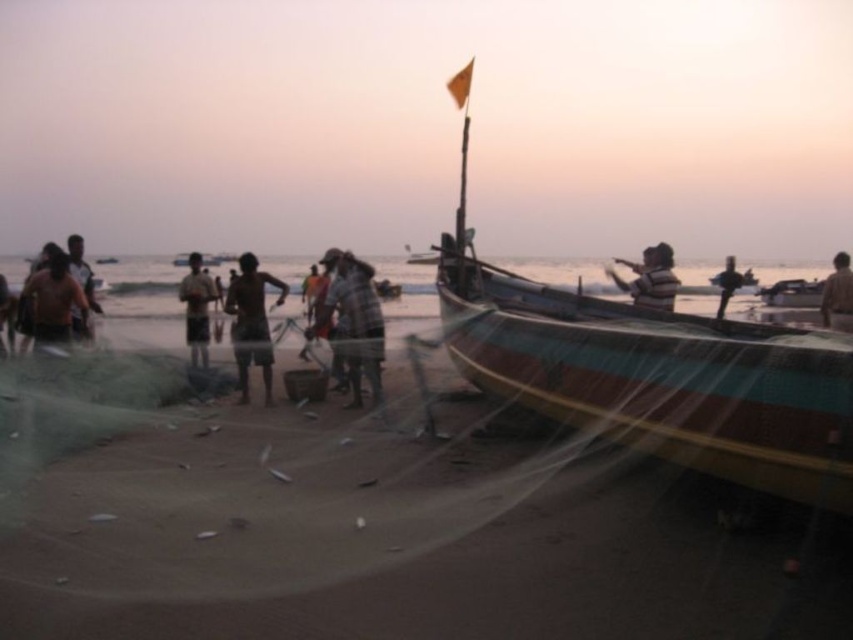
Is checkered fabric shirt at center behind light brown fabric shirt at center?

No, it is not.

Does point (367, 353) come behind point (195, 355)?

No.

Between point (373, 323) and point (189, 328), which one is positioned in front?

Positioned in front is point (373, 323).

Where is `checkered fabric shirt at center`? The image size is (853, 640). checkered fabric shirt at center is located at coordinates (354, 320).

Is light brown fabric shirt at center to the left of brown fabric shirt at lower right from the viewer's perspective?

Indeed, light brown fabric shirt at center is positioned on the left side of brown fabric shirt at lower right.

Does point (193, 358) come behind point (846, 324)?

No, it is in front of (846, 324).

At what (x,y) coordinates should I click in order to perform the action: click on light brown fabric shirt at center. Please return your answer as a coordinate pair (x, y). This screenshot has width=853, height=640. Looking at the image, I should click on (196, 308).

In the scene shown: Which is above, wooden boat at center or checkered fabric shirt at center?

wooden boat at center is higher up.

Between wooden boat at center and checkered fabric shirt at center, which one has less height?

Standing shorter between the two is checkered fabric shirt at center.

Is point (840, 460) farther from viewer compared to point (360, 260)?

That is False.

Where is `wooden boat at center`? The height and width of the screenshot is (640, 853). wooden boat at center is located at coordinates (654, 369).